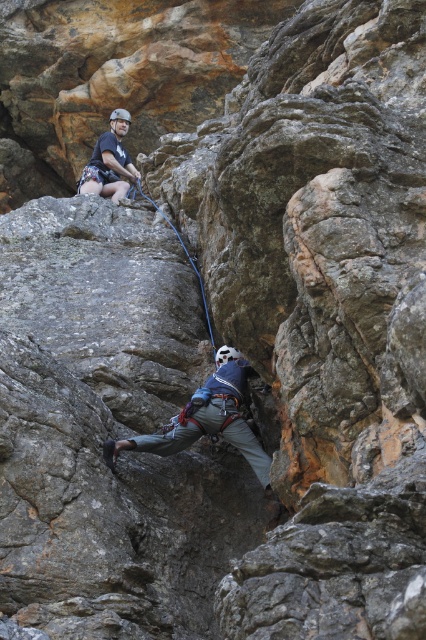
Between matte black helmet at upper center and black rubber rope at center, which one appears on the left side from the viewer's perspective?

matte black helmet at upper center is more to the left.

Which is above, matte black helmet at upper center or black rubber rope at center?

Positioned higher is matte black helmet at upper center.

This screenshot has width=426, height=640. What do you see at coordinates (109, 161) in the screenshot? I see `matte black helmet at upper center` at bounding box center [109, 161].

This screenshot has width=426, height=640. I want to click on matte black helmet at upper center, so click(x=109, y=161).

How far apart are gray fabric helmet at center and black rubber rope at center?

gray fabric helmet at center is 12.18 meters from black rubber rope at center.

Can you confirm if gray fabric helmet at center is wider than black rubber rope at center?

Incorrect, gray fabric helmet at center's width does not surpass black rubber rope at center's.

Measure the distance between point (239, 413) and camera.

The distance of point (239, 413) from camera is 176.84 feet.

Identify the location of gray fabric helmet at center. (206, 419).

Looking at this image, is gray fabric helmet at center taller than matte black helmet at upper center?

In fact, gray fabric helmet at center may be shorter than matte black helmet at upper center.

Is gray fabric helmet at center behind matte black helmet at upper center?

No, it is in front of matte black helmet at upper center.

Is point (172, 422) positioned after point (118, 124)?

No.

Locate an element on the screen. gray fabric helmet at center is located at coordinates (206, 419).